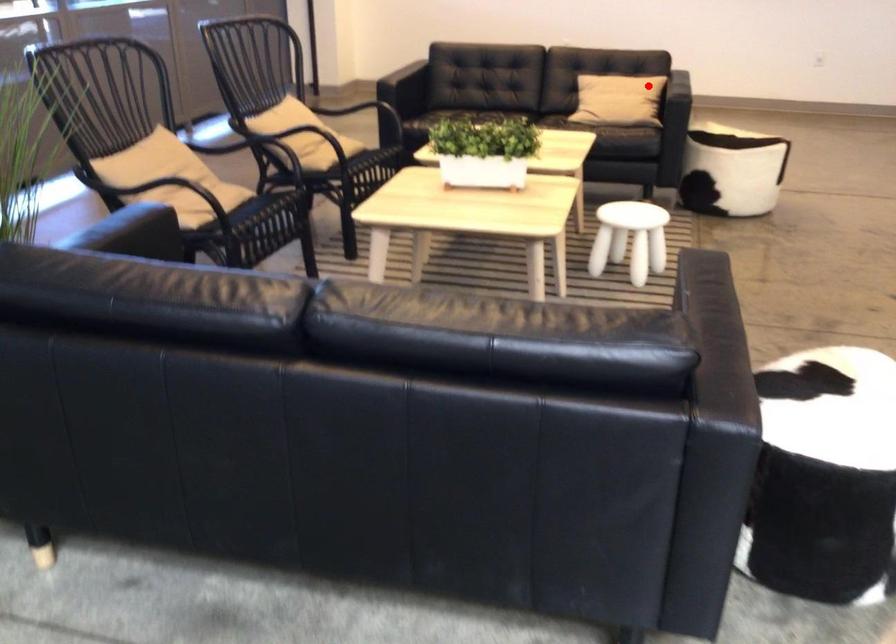
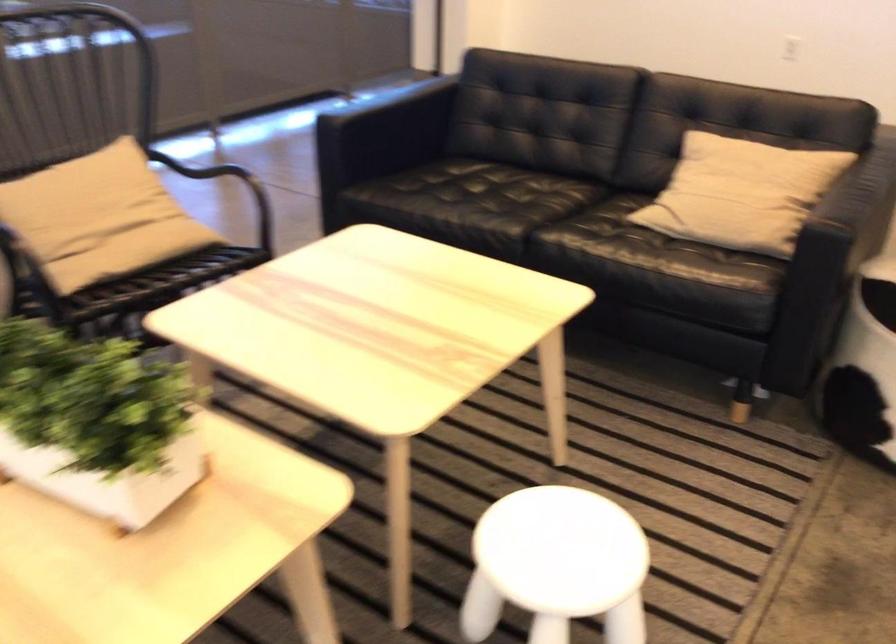
Question: I am providing you with two images of the same scene from different viewpoints. In image1, a red point is highlighted. Considering the same 3D point in image2, which of the following is correct?

Choices:
 (A) It is closer
 (B) It is farther

Answer: (A)